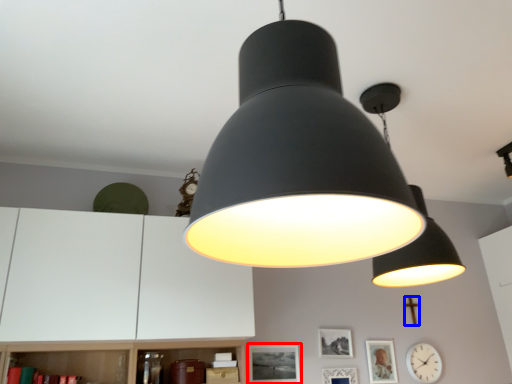
Question: Which object appears closest to the camera in this image, picture frame (highlighted by a red box) or crucifix (highlighted by a blue box)?

Choices:
 (A) picture frame
 (B) crucifix

Answer: (A)